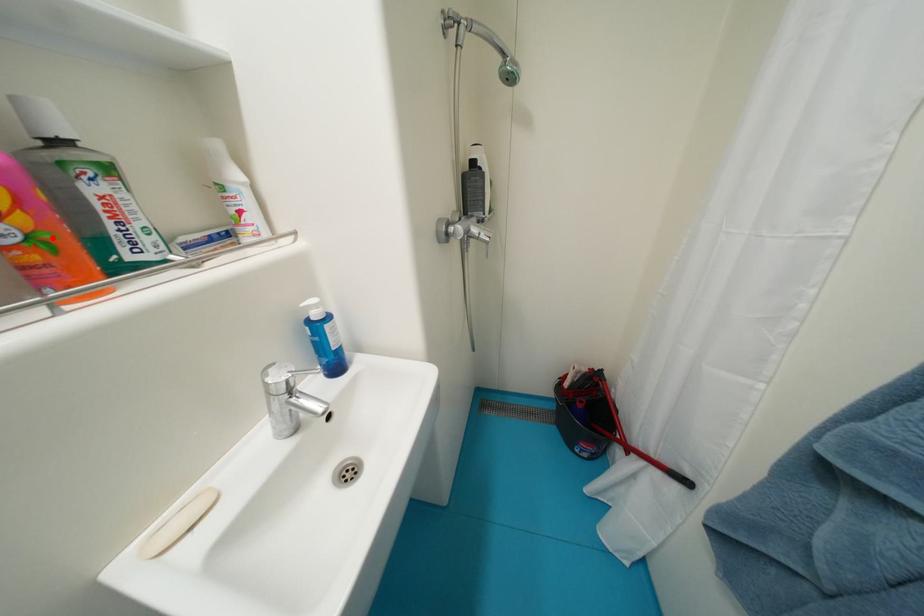
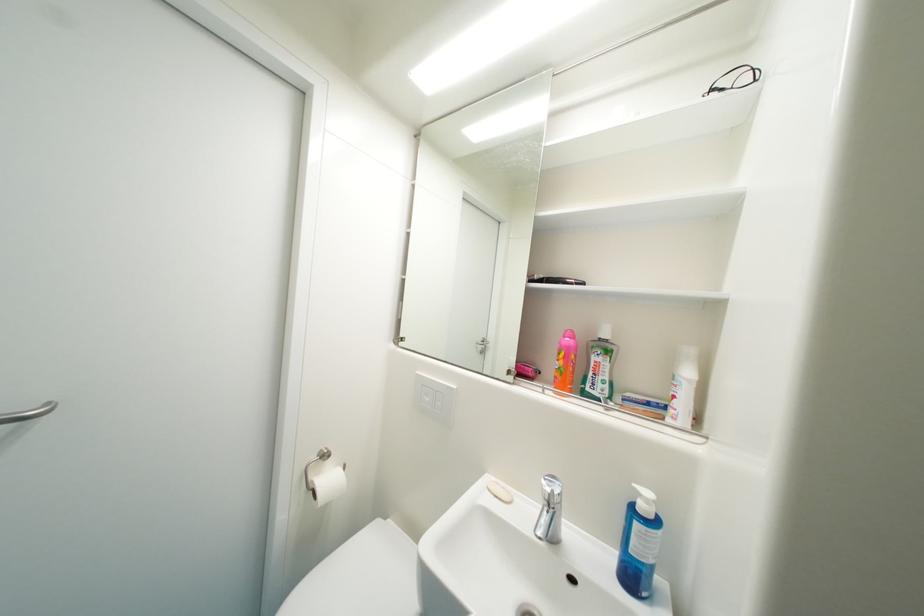
In the second image, find the point that corresponds to the highlighted location in the first image.

(569, 371)